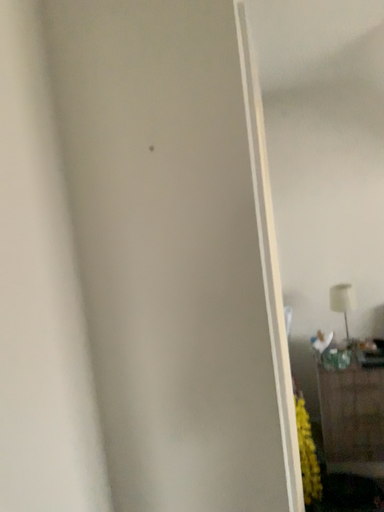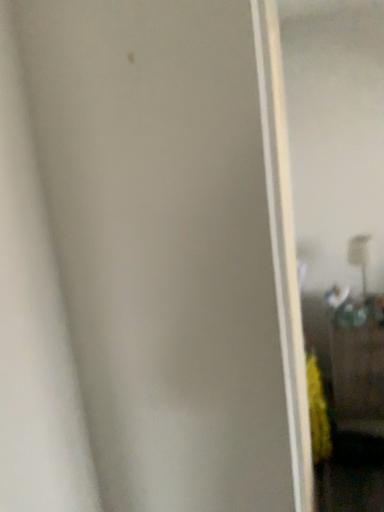
Question: How did the camera likely rotate when shooting the video?

Choices:
 (A) rotated upward
 (B) rotated downward

Answer: (B)